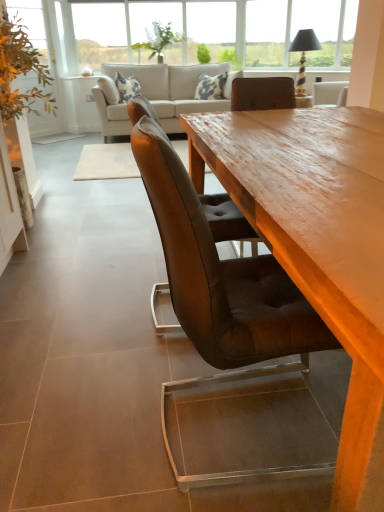
Question: From the image's perspective, is clear glass window at upper center located above or below wooden table at center?

Choices:
 (A) above
 (B) below

Answer: (A)

Question: From a real-world perspective, is clear glass window at upper center above or below wooden table at center?

Choices:
 (A) above
 (B) below

Answer: (A)

Question: Which object is the closest to the green leafy plant at upper center, arranged as the 3th plant when viewed from the left?

Choices:
 (A) wooden table at center
 (B) clear glass window at upper center
 (C) beige fabric couch at upper center
 (D) matte black lampshade at upper right
 (E) green leafy plant at upper center, the second plant in the left-to-right sequence

Answer: (E)

Question: Which of these objects is positioned farthest from the green leafy plant at left, marked as the first plant in a left-to-right arrangement?

Choices:
 (A) matte black lampshade at upper right
 (B) beige fabric couch at upper center
 (C) green leafy plant at upper center, arranged as the 3th plant when viewed from the left
 (D) wooden table at center
 (E) brown leather chair at center

Answer: (C)